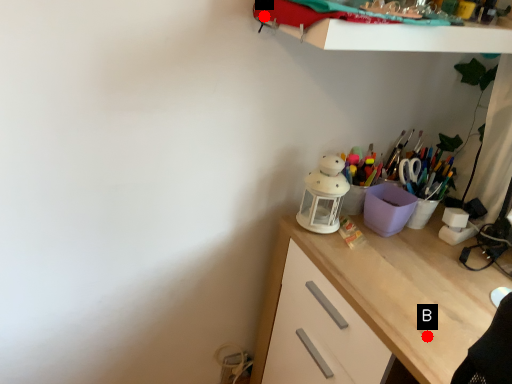
Question: Two points are circled on the image, labeled by A and B beside each circle. Which point is further to the camera?

Choices:
 (A) A is further
 (B) B is further

Answer: (A)